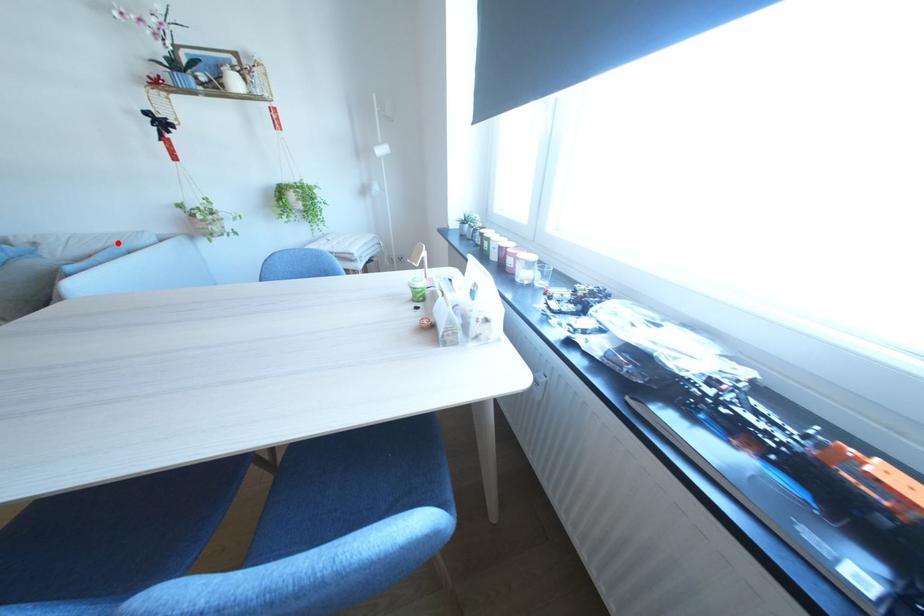
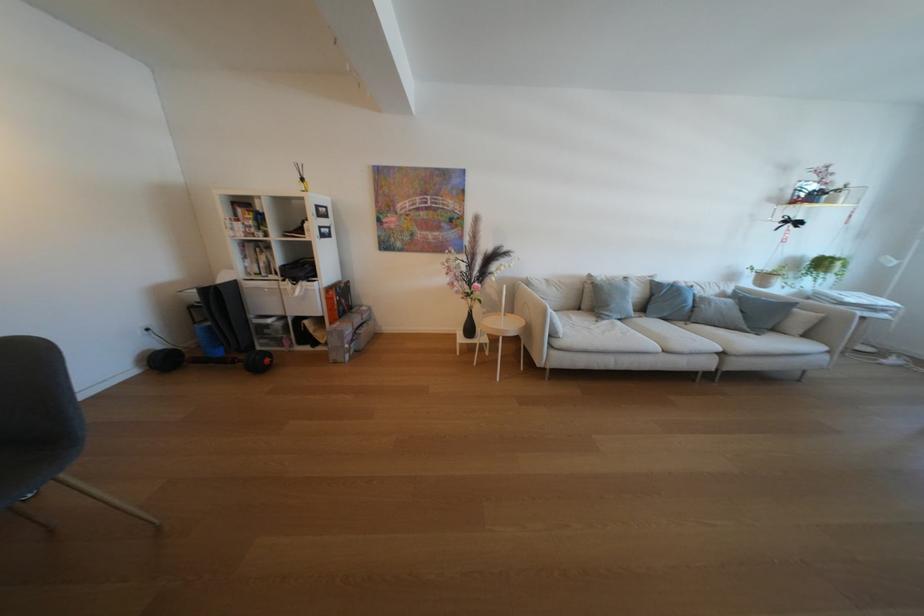
The point at the highlighted location is marked in the first image. Where is the corresponding point in the second image?

(730, 289)